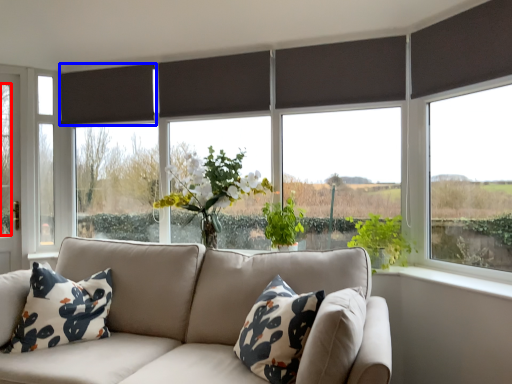
Question: Which object is closer to the camera taking this photo, tree (highlighted by a red box) or curtain (highlighted by a blue box)?

Choices:
 (A) tree
 (B) curtain

Answer: (B)